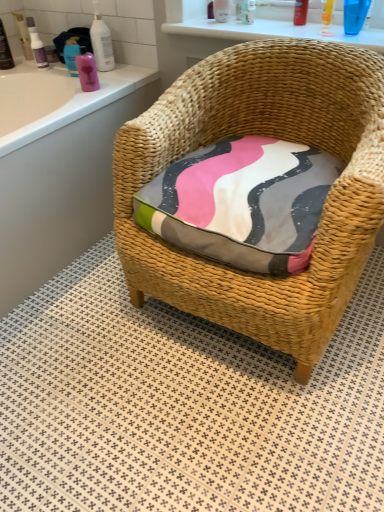
You are a GUI agent. You are given a task and a screenshot of the screen. Output one action in this format:
    pyautogui.click(x=<x>, y=<y>)
    Task: Click on the unoccupied space behind pink glossy bottle at upper left, which is counted as the 6th toiletry, starting from the right
    This screenshot has width=384, height=512.
    Given the screenshot: What is the action you would take?
    point(108,77)